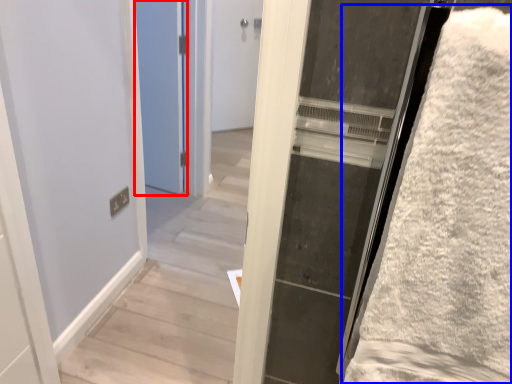
Question: Which object appears closest to the camera in this image, door (highlighted by a red box) or bath towel (highlighted by a blue box)?

Choices:
 (A) door
 (B) bath towel

Answer: (B)